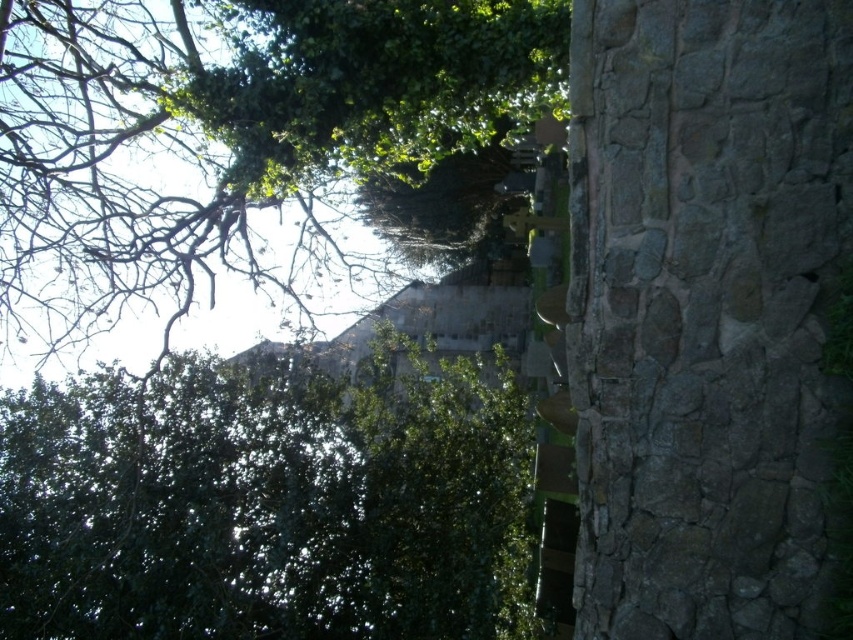
Question: Does green leafy tree at upper left have a lesser width compared to green leafy tree at upper center?

Choices:
 (A) no
 (B) yes

Answer: (A)

Question: Observing the image, what is the correct spatial positioning of gray stone wall at right in reference to green leafy tree at upper left?

Choices:
 (A) right
 (B) left

Answer: (A)

Question: Which point is farther from the camera taking this photo?

Choices:
 (A) (706, 369)
 (B) (296, 300)
 (C) (54, 605)

Answer: (B)

Question: Which object is closer to the camera taking this photo?

Choices:
 (A) gray stone wall at right
 (B) green leafy tree at upper center
 (C) green leafy tree at upper left

Answer: (A)

Question: From the image, what is the correct spatial relationship of gray stone wall at right in relation to green leafy tree at upper left?

Choices:
 (A) right
 (B) left

Answer: (A)

Question: Among these points, which one is farthest from the camera?

Choices:
 (A) (292, 140)
 (B) (634, 104)

Answer: (A)